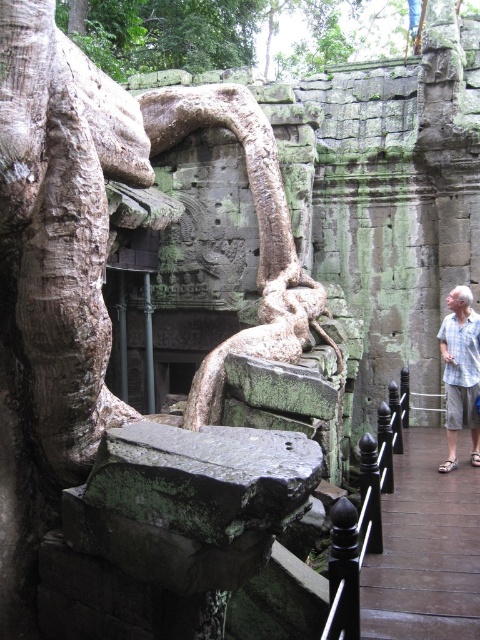
Does black polished metal railing at center appear over light blue shirt at right?

No, black polished metal railing at center is not above light blue shirt at right.

Which is behind, point (387, 472) or point (469, 292)?

The point (469, 292) is behind.

Identify the location of black polished metal railing at center. (363, 513).

At what (x,y) coordinates should I click in order to perform the action: click on black polished metal railing at center. Please return your answer as a coordinate pair (x, y). Image resolution: width=480 pixels, height=640 pixels. Looking at the image, I should click on (363, 513).

Can you confirm if green mossy stone roots at center is positioned to the left of black polished metal railing at center?

Correct, you'll find green mossy stone roots at center to the left of black polished metal railing at center.

Which of these two, green mossy stone roots at center or black polished metal railing at center, stands taller?

green mossy stone roots at center

Is point (94, 132) positioned after point (336, 572)?

Yes, point (94, 132) is farther from viewer.

Locate an element on the screen. This screenshot has width=480, height=640. green mossy stone roots at center is located at coordinates (98, 268).

Is green mossy roots at upper center further to camera compared to brown wooden path at right?

Yes.

Can you confirm if green mossy roots at upper center is thinner than brown wooden path at right?

No.

Which is behind, point (192, 22) or point (405, 557)?

Positioned behind is point (192, 22).

Image resolution: width=480 pixels, height=640 pixels. Find the location of `green mossy roots at upper center`. green mossy roots at upper center is located at coordinates (237, 33).